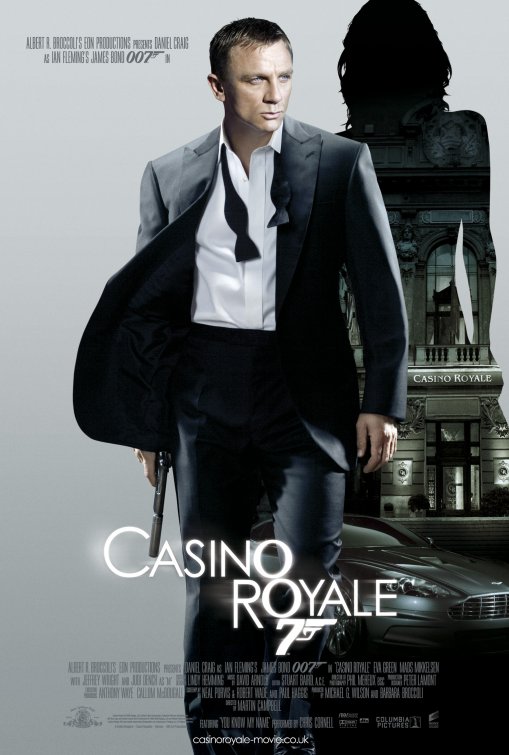
At what (x,y) coordinates should I click in order to perform the action: click on untied bow tie. Please return your answer as a coordinate pair (x, y). The height and width of the screenshot is (755, 509). Looking at the image, I should click on (232, 201), (275, 193).